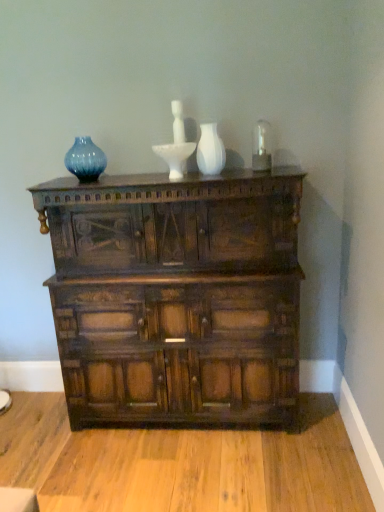
This screenshot has height=512, width=384. What do you see at coordinates (85, 160) in the screenshot? I see `blue glass vase at upper left` at bounding box center [85, 160].

Find the location of `dark wood chest of drawers at center`. dark wood chest of drawers at center is located at coordinates (176, 296).

From a real-world perspective, is blue glass vase at upper left physically above white glossy vase at center?

Yes, from a real-world perspective, blue glass vase at upper left is over white glossy vase at center

Is blue glass vase at upper left shorter than white glossy vase at center?

Correct, blue glass vase at upper left is not as tall as white glossy vase at center.

Is blue glass vase at upper left not inside white glossy vase at center?

That's correct, blue glass vase at upper left is outside of white glossy vase at center.

Is dark wood chest of drawers at center bigger than blue glass vase at upper left?

Indeed, dark wood chest of drawers at center has a larger size compared to blue glass vase at upper left.

This screenshot has height=512, width=384. I want to click on chest of drawers on the right of the blue glass vase at upper left, so click(176, 296).

Is dark wood chest of drawers at center shorter than blue glass vase at upper left?

No.

Which object is thinner, dark wood chest of drawers at center or blue glass vase at upper left?

blue glass vase at upper left is thinner.

Does white glossy vase at center turn towards dark wood chest of drawers at center?

No, white glossy vase at center is not oriented towards dark wood chest of drawers at center.

Looking at this image, which is closer to the camera, (200, 158) or (139, 418)?

Point (200, 158) is closer to the camera than point (139, 418).

You are a GUI agent. You are given a task and a screenshot of the screen. Output one action in this format:
    pyautogui.click(x=<x>, y=<y>)
    Task: Click on the glass vase lying behind the dark wood chest of drawers at center
    Image resolution: width=384 pixels, height=512 pixels.
    Given the screenshot: What is the action you would take?
    pyautogui.click(x=210, y=150)

From a real-world perspective, is white glossy vase at center above or below dark wood chest of drawers at center?

white glossy vase at center is above dark wood chest of drawers at center.

Is blue glass vase at upper left facing away from dark wood chest of drawers at center?

No.

How many degrees apart are the facing directions of blue glass vase at upper left and dark wood chest of drawers at center?

There is a 0.315-degree angle between the facing directions of blue glass vase at upper left and dark wood chest of drawers at center.

Which of these two, blue glass vase at upper left or dark wood chest of drawers at center, is bigger?

With larger size is dark wood chest of drawers at center.

Is dark wood chest of drawers at center far away from white glossy vase at center?

dark wood chest of drawers at center is actually quite close to white glossy vase at center.

From the image's perspective, between dark wood chest of drawers at center and white glossy vase at center, who is located below?

dark wood chest of drawers at center, from the image's perspective.

Is dark wood chest of drawers at center facing towards white glossy vase at center?

No, dark wood chest of drawers at center is not turned towards white glossy vase at center.

The height and width of the screenshot is (512, 384). I want to click on the chest of drawers directly beneath the white glossy vase at center (from a real-world perspective), so click(176, 296).

Who is taller, white glossy vase at center or blue glass vase at upper left?

With more height is white glossy vase at center.

Which object is positioned more to the left, white glossy vase at center or blue glass vase at upper left?

From the viewer's perspective, blue glass vase at upper left appears more on the left side.

From the picture: Measure the distance from white glossy vase at center to blue glass vase at upper left.

A distance of 65.10 centimeters exists between white glossy vase at center and blue glass vase at upper left.

From the image's perspective, is white glossy vase at center above or below blue glass vase at upper left?

From the image's perspective, white glossy vase at center appears below blue glass vase at upper left.

Locate an element on the screen. vase above the white glossy vase at center (from the image's perspective) is located at coordinates (85, 160).

Where is `vase above the dark wood chest of drawers at center (from a real-world perspective)`? Image resolution: width=384 pixels, height=512 pixels. vase above the dark wood chest of drawers at center (from a real-world perspective) is located at coordinates (85, 160).

Based on their spatial positions, is blue glass vase at upper left or white glossy vase at center closer to dark wood chest of drawers at center?

Based on the image, white glossy vase at center appears to be nearer to dark wood chest of drawers at center.

Which object lies further to the anchor point white glossy vase at center, dark wood chest of drawers at center or blue glass vase at upper left?

Based on the image, dark wood chest of drawers at center appears to be further to white glossy vase at center.

Looking at the image, which one is located closer to dark wood chest of drawers at center, white glossy vase at center or blue glass vase at upper left?

The object closer to dark wood chest of drawers at center is white glossy vase at center.

From the image, which object appears to be nearer to white glossy vase at center, blue glass vase at upper left or dark wood chest of drawers at center?

Among the two, blue glass vase at upper left is located nearer to white glossy vase at center.

Estimate the real-world distances between objects in this image. Which object is closer to blue glass vase at upper left, dark wood chest of drawers at center or white glossy vase at center?

Among the two, white glossy vase at center is located nearer to blue glass vase at upper left.

In the scene shown: Looking at the image, which one is located further to blue glass vase at upper left, white glossy vase at center or dark wood chest of drawers at center?

dark wood chest of drawers at center is further to blue glass vase at upper left.

This screenshot has width=384, height=512. I want to click on glass vase between blue glass vase at upper left and dark wood chest of drawers at center in the up-down direction, so click(x=210, y=150).